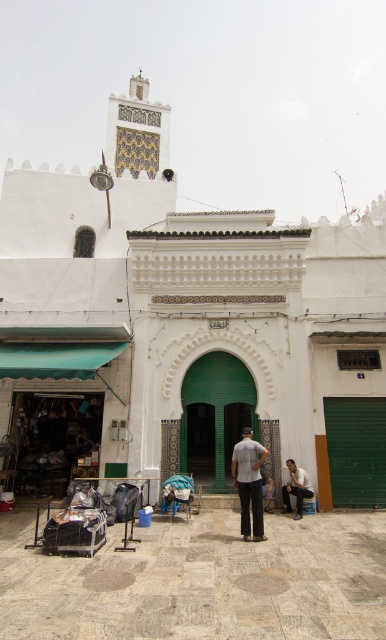
Which is in front, point (250, 532) or point (267, 506)?

Point (250, 532) is more forward.

Which is in front, point (250, 476) or point (264, 486)?

Positioned in front is point (250, 476).

The width and height of the screenshot is (386, 640). I want to click on light gray cotton pants at center, so click(248, 483).

Between point (243, 452) and point (301, 515), which one is positioned behind?

The point (301, 515) is more distant.

Is light gray cotton pants at center taller than white cotton shirt at lower right?

Yes, light gray cotton pants at center is taller than white cotton shirt at lower right.

Is point (252, 540) closer to viewer compared to point (286, 509)?

Yes.

The height and width of the screenshot is (640, 386). What are the coordinates of `light gray cotton pants at center` in the screenshot? It's located at (248, 483).

Who is more distant from viewer, (269, 316) or (269, 480)?

The point (269, 316) is behind.

In the scene shown: How much distance is there between white textured wall at center and light gray fabric pants at center?

white textured wall at center and light gray fabric pants at center are 16.61 meters apart from each other.

Between point (281, 236) and point (262, 468), which one is positioned in front?

Positioned in front is point (262, 468).

Find the location of a particular element. This screenshot has height=640, width=386. white textured wall at center is located at coordinates (186, 323).